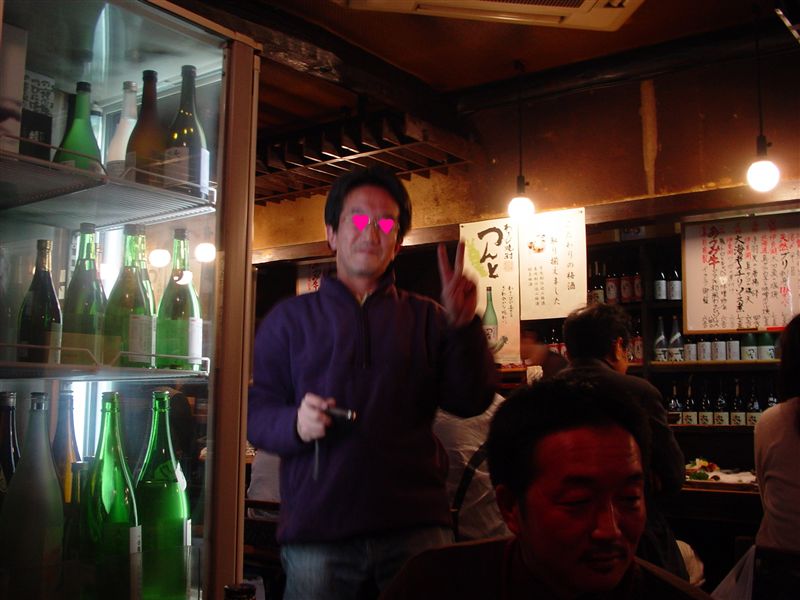
Find the location of `bottle`. bottle is located at coordinates (182, 491).